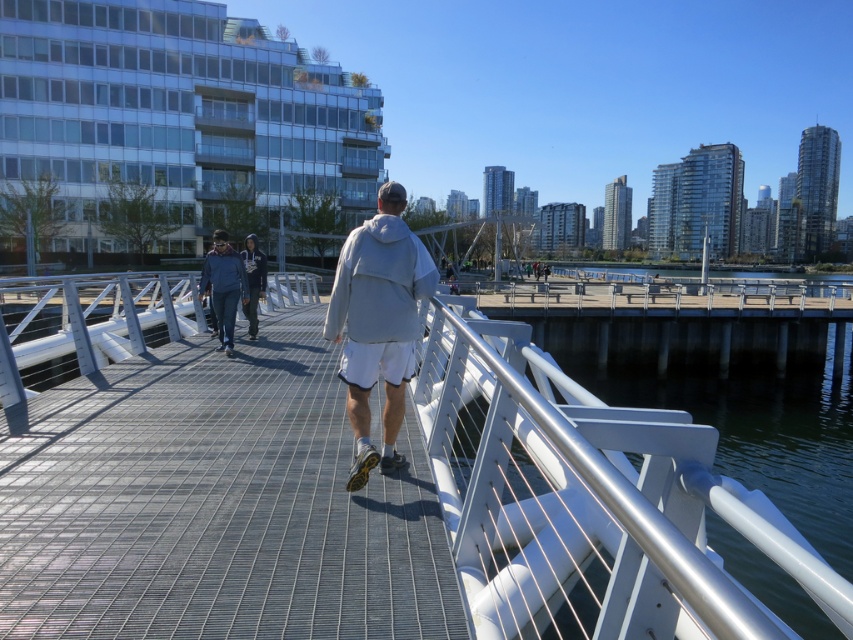
Does metal grid walkway at center have a larger size compared to white cotton hoodie at center?

Yes.

Is metal grid walkway at center shorter than white cotton hoodie at center?

Yes, metal grid walkway at center is shorter than white cotton hoodie at center.

Who is more distant from viewer, (201, 460) or (419, 241)?

The point (201, 460) is more distant.

At what (x,y) coordinates should I click in order to perform the action: click on metal grid walkway at center. Please return your answer as a coordinate pair (x, y). The height and width of the screenshot is (640, 853). Looking at the image, I should click on (215, 502).

Does metal grid walkway at center appear over light gray hoodie at center?

Incorrect, metal grid walkway at center is not positioned above light gray hoodie at center.

Can you confirm if metal grid walkway at center is shorter than light gray hoodie at center?

Yes.

Between point (308, 358) and point (358, 314), which one is positioned behind?

Positioned behind is point (308, 358).

I want to click on metal grid walkway at center, so click(x=215, y=502).

Who is positioned more to the right, metal grid walkway at center or blue fleece jacket at center?

metal grid walkway at center

Between metal grid walkway at center and blue fleece jacket at center, which one is positioned higher?

blue fleece jacket at center is above.

Between point (88, 557) and point (200, 282), which one is positioned behind?

The point (200, 282) is more distant.

The height and width of the screenshot is (640, 853). I want to click on metal grid walkway at center, so click(x=215, y=502).